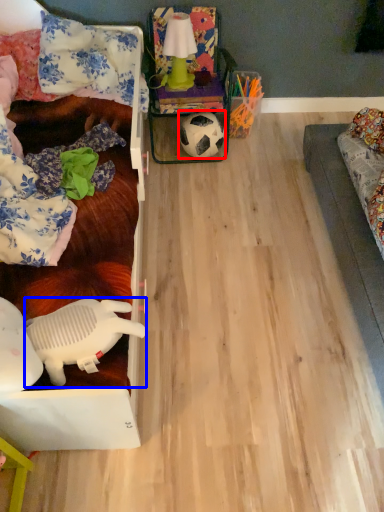
Question: Which point is closer to the camera, football (highlighted by a red box) or toy (highlighted by a blue box)?

Choices:
 (A) football
 (B) toy

Answer: (B)